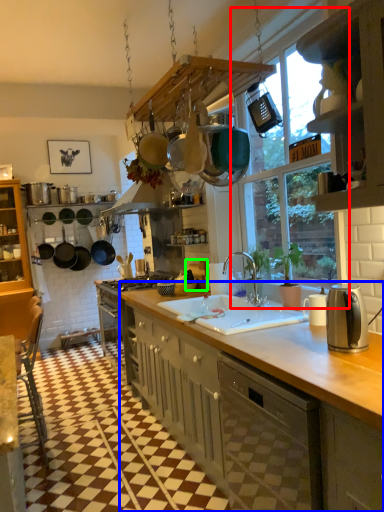
Question: Based on their relative distances, which object is nearer to window (highlighted by a red box)? Choose from cabinetry (highlighted by a blue box) and appliance (highlighted by a green box).

Choices:
 (A) cabinetry
 (B) appliance

Answer: (B)